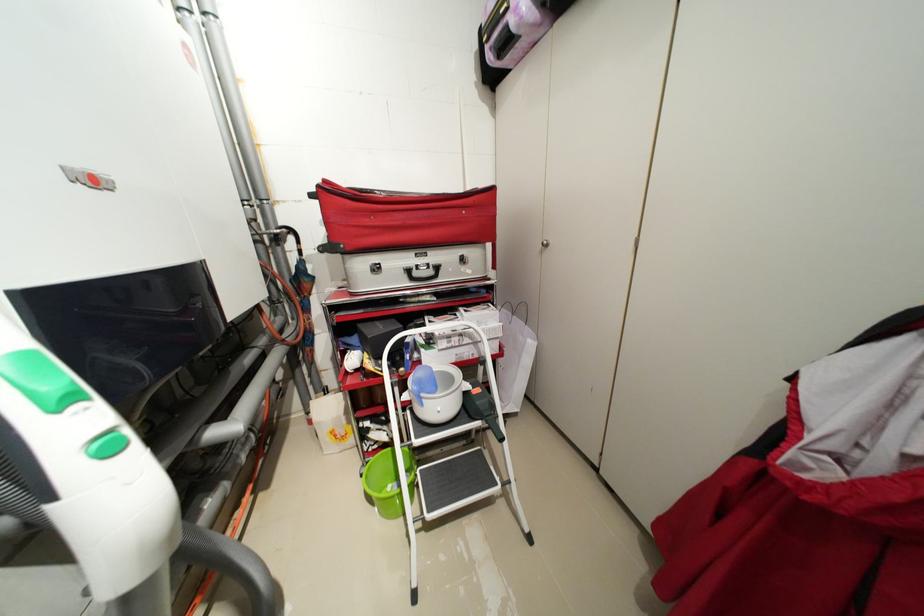
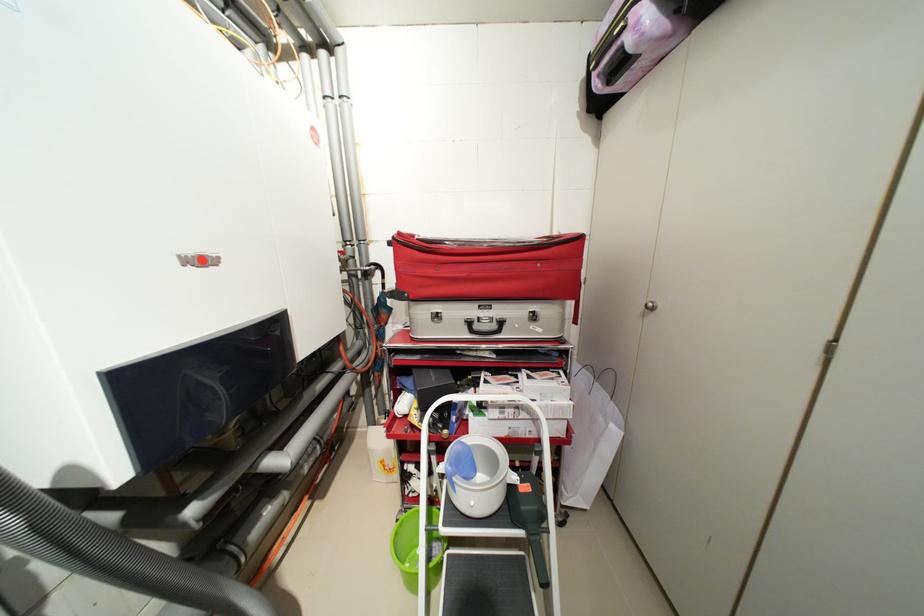
In the second image, find the point that corresponds to pixel 439 273 in the first image.

(502, 326)